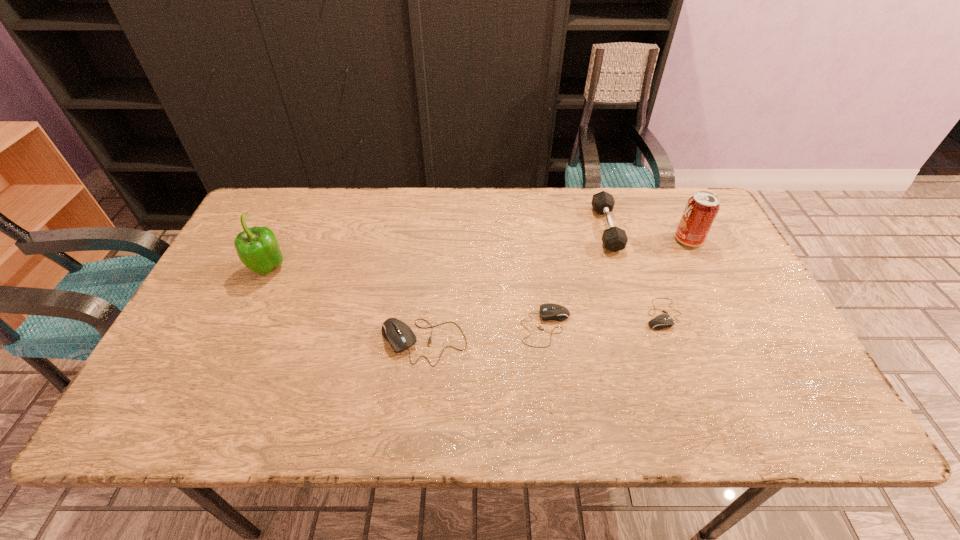
Please point out where to position a new computer mouse on the left to maintain spacing. Please provide its 2D coordinates. Your answer should be formatted as a tuple, i.e. [(x, y)], where the tuple contains the x and y coordinates of a point satisfying the conditions above.

[(293, 357)]